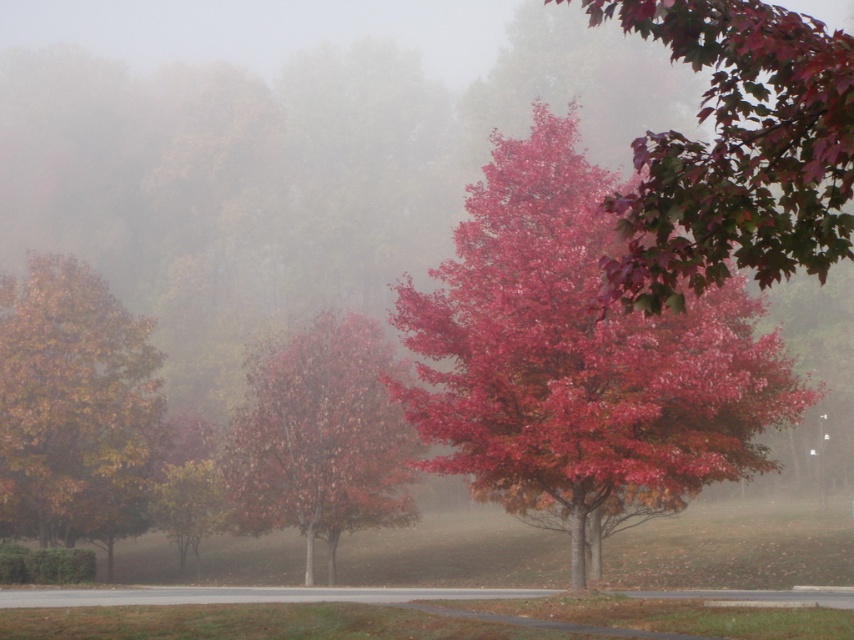
Question: Estimate the real-world distances between objects in this image. Which object is farther from the yellowish-brown wood tree at left?

Choices:
 (A) glossy red leaves at upper right
 (B) shiny crimson leaves at center

Answer: (A)

Question: Which of these objects is positioned farthest from the glossy red leaves at upper right?

Choices:
 (A) glossy red tree at center
 (B) shiny crimson leaves at center
 (C) yellowish-brown wood tree at left

Answer: (C)

Question: Is shiny crimson leaves at center to the right of yellowish-brown wood tree at left from the viewer's perspective?

Choices:
 (A) no
 (B) yes

Answer: (B)

Question: Which object is the closest to the glossy red leaves at upper right?

Choices:
 (A) yellowish-brown wood tree at left
 (B) shiny crimson leaves at center
 (C) glossy red tree at center

Answer: (B)

Question: Does glossy red leaves at upper right appear on the left side of glossy red tree at center?

Choices:
 (A) yes
 (B) no

Answer: (B)

Question: Can you confirm if yellowish-brown wood tree at left is smaller than glossy red tree at center?

Choices:
 (A) no
 (B) yes

Answer: (B)